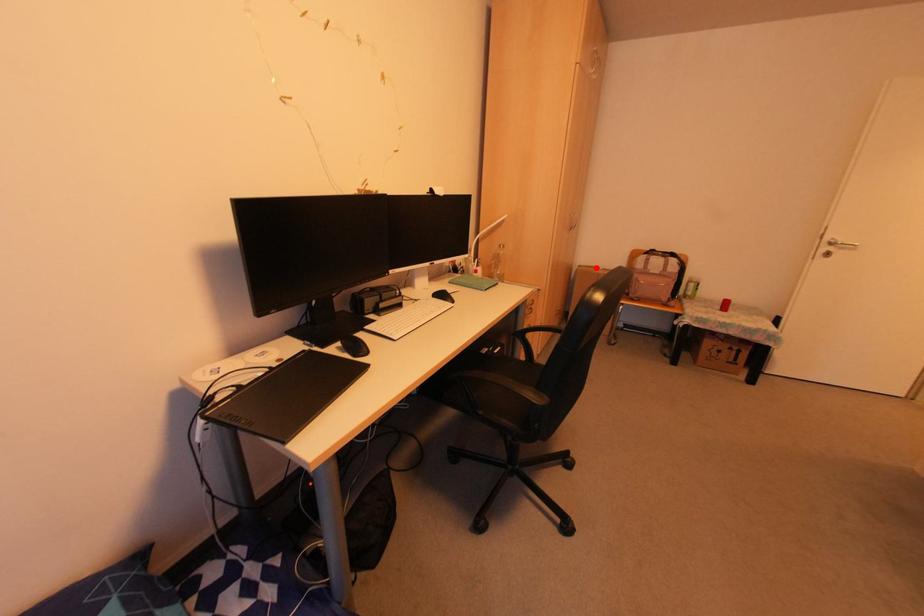
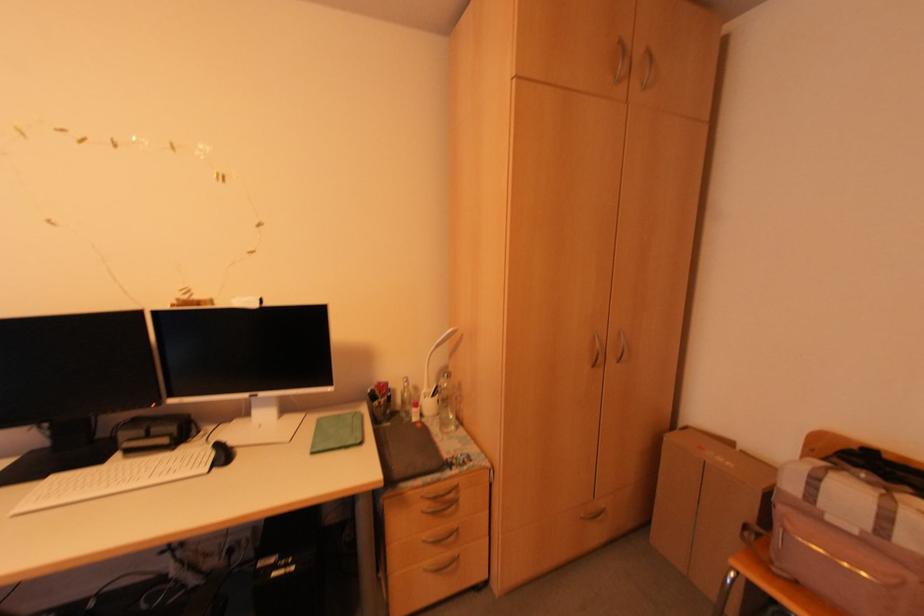
Where in the second image is the point corresponding to the highlighted location from the first image?

(728, 444)